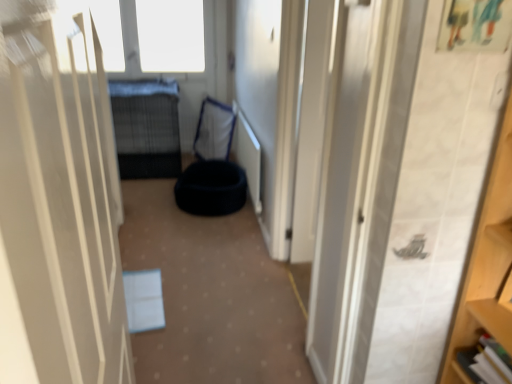
The width and height of the screenshot is (512, 384). Describe the element at coordinates (212, 166) in the screenshot. I see `black fabric bean bag at center, the 2th bean bag chair positioned from the front` at that location.

Measure the distance between point (175, 210) and camera.

3.54 meters.

You are a GUI agent. You are given a task and a screenshot of the screen. Output one action in this format:
    pyautogui.click(x=<x>, y=<y>)
    Task: Click on the blue fabric pet bed at center
    The image size is (512, 384).
    Given the screenshot: What is the action you would take?
    pos(211,295)

Describe the element at coordinates (146, 127) in the screenshot. I see `black wire mesh bed at center` at that location.

Where is `black fabric bean bag at center, the 1th bean bag chair in the back-to-front sequence`? This screenshot has width=512, height=384. black fabric bean bag at center, the 1th bean bag chair in the back-to-front sequence is located at coordinates (212, 166).

From a real-world perspective, is white matte door at center on top of blue fabric pet bed at center?

Yes.

Who is bigger, white matte door at center or blue fabric pet bed at center?

Bigger between the two is blue fabric pet bed at center.

Does white matte door at center appear on the left side of black wire mesh bed at center?

Incorrect, white matte door at center is not on the left side of black wire mesh bed at center.

Which point is more forward, (17, 267) or (118, 129)?

The point (17, 267) is more forward.

Is white matte door at center facing towards black wire mesh bed at center?

No, white matte door at center is not oriented towards black wire mesh bed at center.

The image size is (512, 384). Find the location of `bed that appears behind the black fabric bean bag at center, the 1th bean bag chair positioned from the front`. bed that appears behind the black fabric bean bag at center, the 1th bean bag chair positioned from the front is located at coordinates (146, 127).

From a real-world perspective, is black wire mesh bed at center under black fabric bean bag at center, the 1th bean bag chair positioned from the front?

No, from a real-world perspective, black wire mesh bed at center is not beneath black fabric bean bag at center, the 1th bean bag chair positioned from the front.

Considering the relative positions of black wire mesh bed at center and black fabric bean bag at center, arranged as the second bean bag chair when viewed from the back, in the image provided, is black wire mesh bed at center to the left of black fabric bean bag at center, arranged as the second bean bag chair when viewed from the back, from the viewer's perspective?

Yes.

Between black wire mesh bed at center and black fabric bean bag at center, the 1th bean bag chair positioned from the front, which one has larger width?

black wire mesh bed at center is wider.

Does blue fabric pet bed at center have a lesser width compared to black fabric bean bag at center, arranged as the second bean bag chair when viewed from the back?

No, blue fabric pet bed at center is not thinner than black fabric bean bag at center, arranged as the second bean bag chair when viewed from the back.

I want to click on corridor located underneath the black fabric bean bag at center, the 1th bean bag chair positioned from the front (from a real-world perspective), so 211,295.

In the image, is blue fabric pet bed at center on the left side or the right side of black fabric bean bag at center, arranged as the second bean bag chair when viewed from the back?

blue fabric pet bed at center is positioned on black fabric bean bag at center, arranged as the second bean bag chair when viewed from the back,'s left side.

How much distance is there between blue fabric pet bed at center and black fabric bean bag at center, arranged as the second bean bag chair when viewed from the back?

Result: The distance of blue fabric pet bed at center from black fabric bean bag at center, arranged as the second bean bag chair when viewed from the back, is 24.26 inches.

Which of these two, black fabric bean bag at center, arranged as the second bean bag chair when viewed from the back, or blue fabric pet bed at center, stands taller?

Standing taller between the two is black fabric bean bag at center, arranged as the second bean bag chair when viewed from the back.

The image size is (512, 384). I want to click on the 2nd bean bag chair counting from the right side of the blue fabric pet bed at center, so click(211, 188).

Considering their positions, is black fabric bean bag at center, arranged as the second bean bag chair when viewed from the back, located in front of or behind blue fabric pet bed at center?

Visually, black fabric bean bag at center, arranged as the second bean bag chair when viewed from the back, is located behind blue fabric pet bed at center.

Do you think black fabric bean bag at center, the 1th bean bag chair positioned from the front, is within blue fabric pet bed at center, or outside of it?

black fabric bean bag at center, the 1th bean bag chair positioned from the front, is outside blue fabric pet bed at center.

Would you say black fabric bean bag at center, arranged as the second bean bag chair when viewed from the back, is part of black fabric bean bag at center, the 1th bean bag chair in the back-to-front sequence,'s contents?

No.

Considering the positions of objects black fabric bean bag at center, the 1th bean bag chair in the back-to-front sequence, and black fabric bean bag at center, the 1th bean bag chair positioned from the front, in the image provided, who is more to the left, black fabric bean bag at center, the 1th bean bag chair in the back-to-front sequence, or black fabric bean bag at center, the 1th bean bag chair positioned from the front,?

black fabric bean bag at center, the 1th bean bag chair in the back-to-front sequence, is more to the left.

Is black fabric bean bag at center, the 2th bean bag chair positioned from the front, with black fabric bean bag at center, arranged as the second bean bag chair when viewed from the back?

black fabric bean bag at center, the 2th bean bag chair positioned from the front, is not next to black fabric bean bag at center, arranged as the second bean bag chair when viewed from the back, and they're not touching.

The height and width of the screenshot is (384, 512). Identify the location of corridor located in front of the black fabric bean bag at center, the 2th bean bag chair positioned from the front. (211, 295).

Does black fabric bean bag at center, the 2th bean bag chair positioned from the front, have a greater height compared to blue fabric pet bed at center?

Correct, black fabric bean bag at center, the 2th bean bag chair positioned from the front, is much taller as blue fabric pet bed at center.

Can you confirm if black fabric bean bag at center, the 1th bean bag chair in the back-to-front sequence, is bigger than blue fabric pet bed at center?

Correct, black fabric bean bag at center, the 1th bean bag chair in the back-to-front sequence, is larger in size than blue fabric pet bed at center.

What's the angular difference between black fabric bean bag at center, the 1th bean bag chair in the back-to-front sequence, and blue fabric pet bed at center's facing directions?

The facing directions of black fabric bean bag at center, the 1th bean bag chair in the back-to-front sequence, and blue fabric pet bed at center are 69.7 degrees apart.

Locate an element on the screen. This screenshot has height=384, width=512. corridor behind the white matte door at center is located at coordinates (211, 295).

Locate an element on the screen. door that appears on the right of black wire mesh bed at center is located at coordinates (62, 201).

Considering their positions, is black fabric bean bag at center, the 2th bean bag chair positioned from the front, positioned closer to white matte door at center than blue fabric pet bed at center?

blue fabric pet bed at center.

Consider the image. When comparing their distances from black wire mesh bed at center, does black fabric bean bag at center, arranged as the second bean bag chair when viewed from the back, or black fabric bean bag at center, the 2th bean bag chair positioned from the front, seem closer?

black fabric bean bag at center, the 2th bean bag chair positioned from the front.

Looking at the image, which one is located further to black wire mesh bed at center, blue fabric pet bed at center or black fabric bean bag at center, the 1th bean bag chair positioned from the front?

Among the two, blue fabric pet bed at center is located further to black wire mesh bed at center.

When comparing their distances from black fabric bean bag at center, the 1th bean bag chair in the back-to-front sequence, does blue fabric pet bed at center or black wire mesh bed at center seem closer?

black wire mesh bed at center is closer to black fabric bean bag at center, the 1th bean bag chair in the back-to-front sequence.

From the picture: Looking at the image, which one is located closer to blue fabric pet bed at center, black wire mesh bed at center or white matte door at center?

white matte door at center.

Considering their positions, is blue fabric pet bed at center positioned closer to black fabric bean bag at center, arranged as the second bean bag chair when viewed from the back, than black wire mesh bed at center?

blue fabric pet bed at center is closer to black fabric bean bag at center, arranged as the second bean bag chair when viewed from the back.

Which object lies nearer to the anchor point black fabric bean bag at center, the 2th bean bag chair positioned from the front, black fabric bean bag at center, the 1th bean bag chair positioned from the front, or white matte door at center?

The object closer to black fabric bean bag at center, the 2th bean bag chair positioned from the front, is black fabric bean bag at center, the 1th bean bag chair positioned from the front.

When comparing their distances from black fabric bean bag at center, the 1th bean bag chair positioned from the front, does black fabric bean bag at center, the 2th bean bag chair positioned from the front, or black wire mesh bed at center seem closer?

black fabric bean bag at center, the 2th bean bag chair positioned from the front, lies closer to black fabric bean bag at center, the 1th bean bag chair positioned from the front, than the other object.

The height and width of the screenshot is (384, 512). Find the location of `corridor between white matte door at center and black fabric bean bag at center, arranged as the second bean bag chair when viewed from the back, from front to back`. corridor between white matte door at center and black fabric bean bag at center, arranged as the second bean bag chair when viewed from the back, from front to back is located at coordinates (211, 295).

Where is `corridor between white matte door at center and black wire mesh bed at center along the z-axis`? corridor between white matte door at center and black wire mesh bed at center along the z-axis is located at coordinates (211, 295).

Identify the location of corridor positioned between white matte door at center and black fabric bean bag at center, the 1th bean bag chair in the back-to-front sequence, from near to far. 211,295.

Identify the location of bed between white matte door at center and black fabric bean bag at center, the 2th bean bag chair positioned from the front, in the front-back direction. (146, 127).